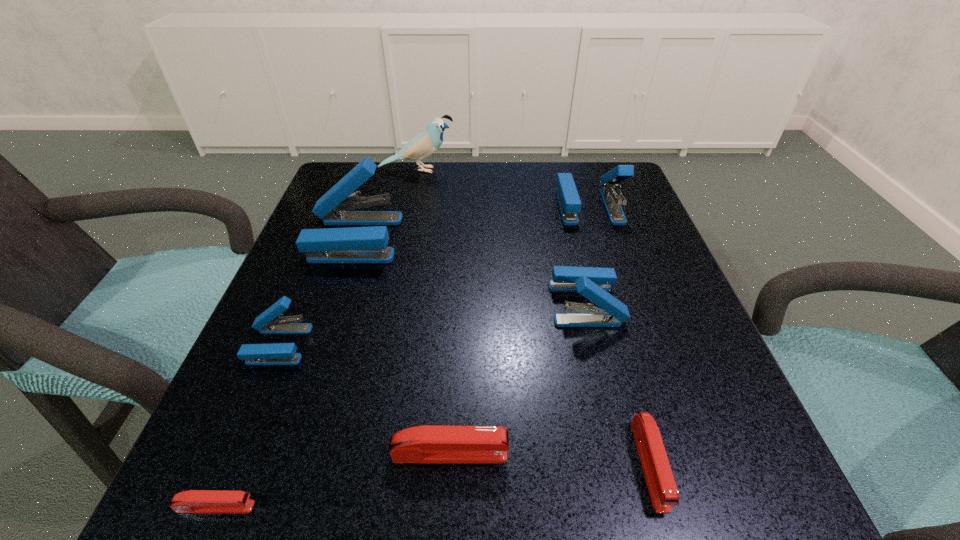
Find the location of `red stapler that is the nearest to the smallest red stapler`. red stapler that is the nearest to the smallest red stapler is located at coordinates click(428, 443).

At what (x,y) coordinates should I click in order to perform the action: click on free space that satisfies the following two spatial constraints: 1. on the front side of the fourth tallest object; 2. on the front-facing side of the shortest stapler. Please return your answer as a coordinate pair (x, y). The image size is (960, 540). Looking at the image, I should click on (635, 507).

Identify the location of vacant position in the image that satisfies the following two spatial constraints: 1. at the face of the second tallest stapler; 2. on the right side of the farthest object. The image size is (960, 540). (409, 206).

This screenshot has height=540, width=960. Find the location of `free space that satisfies the following two spatial constraints: 1. on the front side of the second smallest blue stapler; 2. on the front-facing side of the biggest red stapler`. free space that satisfies the following two spatial constraints: 1. on the front side of the second smallest blue stapler; 2. on the front-facing side of the biggest red stapler is located at coordinates point(621,454).